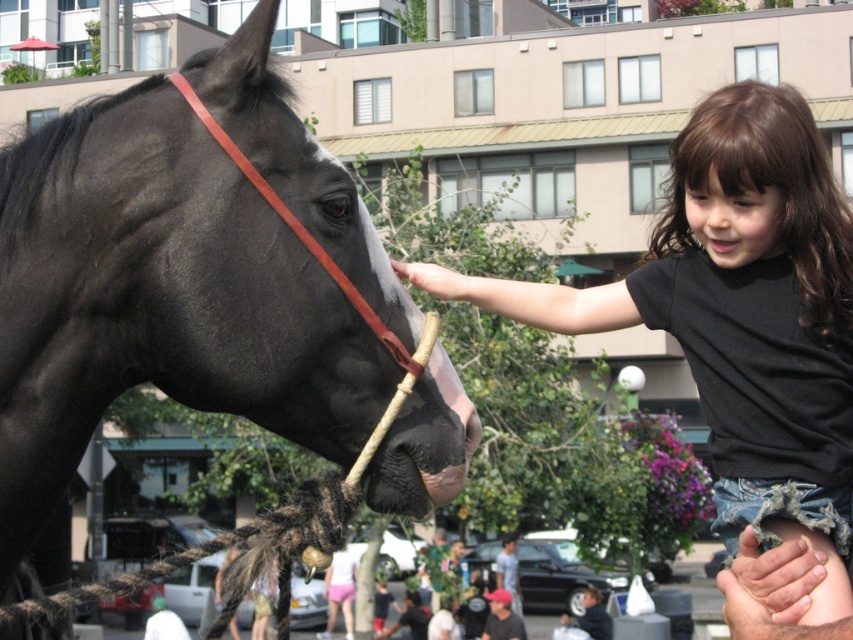
You are a photographer trying to capture a candid shot of the girl and the horse. You notice two items at lower center in the image. Which item is positioned lower between the dark gray baseball cap at lower center and the gray fabric shirt at lower center?

The dark gray baseball cap at lower center is positioned lower than the gray fabric shirt at lower center.

You are a photographer trying to capture a candid shot of the girl and the horse. You notice two items at the lower center of your viewfinder. Which item is on the left side when looking at the dark gray baseball cap at lower center and the gray fabric shirt at lower center?

The dark gray baseball cap at lower center is positioned on the left side of the gray fabric shirt at lower center, so the dark gray baseball cap at lower center is on the left.